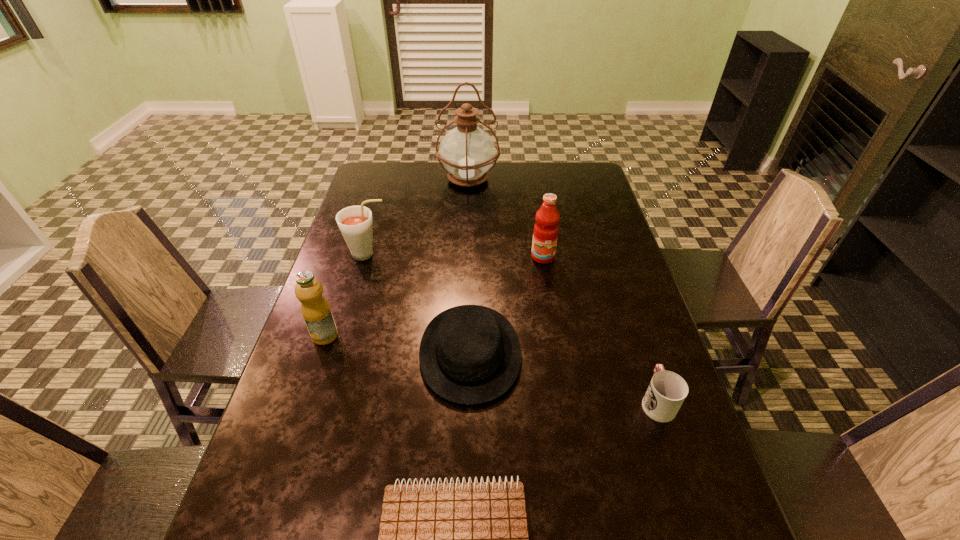
You are a GUI agent. You are given a task and a screenshot of the screen. Output one action in this format:
    pyautogui.click(x=<x>, y=<y>)
    Task: Click on the vacant space located 0.120m on the front label of the nearer fruit juice
    
    Given the screenshot: What is the action you would take?
    pyautogui.click(x=308, y=387)

Identify the location of free spot located 0.280m on the drink side of the root beer. The width and height of the screenshot is (960, 540). (480, 254).

Locate an element on the screen. The height and width of the screenshot is (540, 960). vacant space located 0.360m on the back of the fedora is located at coordinates (472, 229).

Find the location of a particular element. The width and height of the screenshot is (960, 540). vacant area located 0.400m on the handle side of the cup is located at coordinates coord(613,268).

Where is `vacant region located on the handle side of the cup`? This screenshot has width=960, height=540. vacant region located on the handle side of the cup is located at coordinates (615, 274).

You are a GUI agent. You are given a task and a screenshot of the screen. Output one action in this format:
    pyautogui.click(x=<x>, y=<y>)
    Task: Click on the vacant space located on the handle side of the cup
    The height and width of the screenshot is (540, 960).
    Given the screenshot: What is the action you would take?
    pyautogui.click(x=614, y=272)

You are a GUI agent. You are given a task and a screenshot of the screen. Output one action in this format:
    pyautogui.click(x=<x>, y=<y>)
    Task: Click on the object situated at the far edge
    
    Given the screenshot: What is the action you would take?
    pyautogui.click(x=467, y=152)

This screenshot has width=960, height=540. I want to click on fruit juice located at the left edge, so click(316, 311).

You are a GUI agent. You are given a task and a screenshot of the screen. Output one action in this format:
    pyautogui.click(x=<x>, y=<y>)
    Task: Click on the root beer at the left edge
    The height and width of the screenshot is (540, 960).
    Given the screenshot: What is the action you would take?
    pyautogui.click(x=355, y=222)

Locate an element on the screen. object that is at the right edge is located at coordinates tap(667, 391).